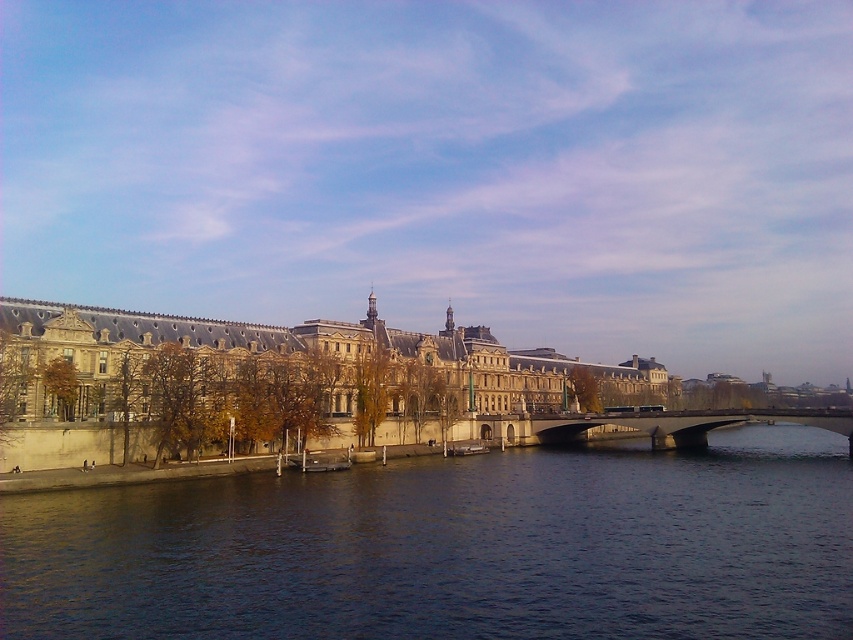
Does point (520, 580) come in front of point (387, 330)?

Yes, point (520, 580) is closer to viewer.

Who is more forward, (810, 432) or (454, 330)?

Point (454, 330) is in front.

You are a GUI agent. You are given a task and a screenshot of the screen. Output one action in this format:
    pyautogui.click(x=<x>, y=<y>)
    Task: Click on the dark blue water at center
    This screenshot has width=853, height=640.
    Given the screenshot: What is the action you would take?
    pyautogui.click(x=453, y=547)

Who is positioned more to the right, stone building at center or concrete bridge at center?

From the viewer's perspective, concrete bridge at center appears more on the right side.

Does stone building at center come behind concrete bridge at center?

No, it is not.

Is point (459, 337) in front of point (556, 436)?

No, (459, 337) is behind (556, 436).

At what (x,y) coordinates should I click in order to perform the action: click on stone building at center. Please return your answer as a coordinate pair (x, y). Looking at the image, I should click on (293, 364).

Can you confirm if dark blue water at center is bigger than concrete bridge at center?

No, dark blue water at center is not bigger than concrete bridge at center.

What do you see at coordinates (453, 547) in the screenshot? I see `dark blue water at center` at bounding box center [453, 547].

Which is in front, point (137, 506) or point (590, 424)?

Point (137, 506) is more forward.

Where is `dark blue water at center`? This screenshot has width=853, height=640. dark blue water at center is located at coordinates (453, 547).